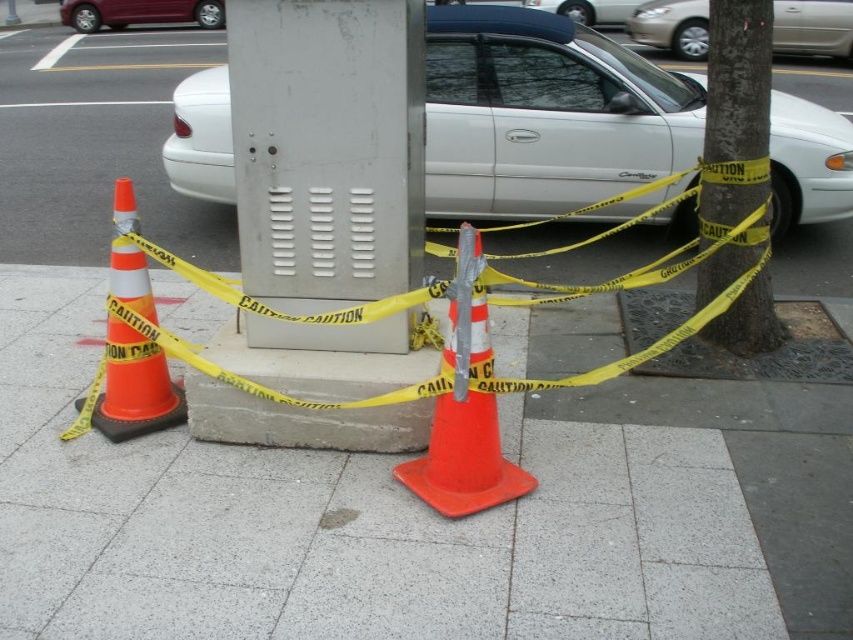
Question: Among these points, which one is farthest from the camera?

Choices:
 (A) (650, 28)
 (B) (560, 4)
 (C) (140, 256)
 (D) (216, 8)

Answer: (D)

Question: Is yellow caution tape at center thinner than orange reflective cone at left?

Choices:
 (A) no
 (B) yes

Answer: (A)

Question: Does orange plastic cone at center lie in front of yellow caution tape at center?

Choices:
 (A) no
 (B) yes

Answer: (B)

Question: Can you confirm if orange plastic cone at center is smaller than yellow caution tape at center?

Choices:
 (A) no
 (B) yes

Answer: (A)

Question: Which point is farther to the camera?

Choices:
 (A) (126, 198)
 (B) (616, 22)
 (C) (521, 468)

Answer: (B)

Question: Based on their relative distances, which object is nearer to the metallic red sedan at upper left?

Choices:
 (A) white glossy sedan at upper center
 (B) yellow caution tape at center

Answer: (A)